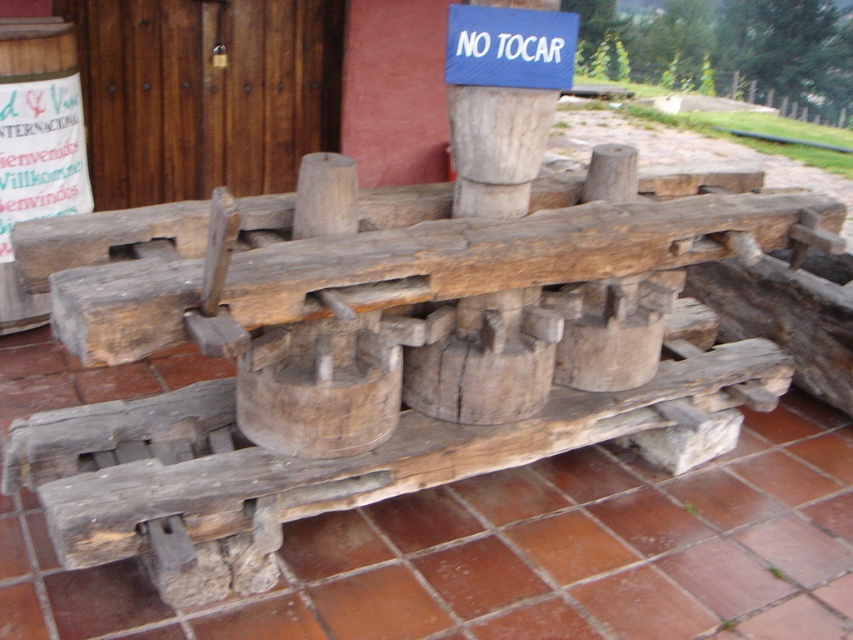
You are standing in front of the rustic wooden structure and notice a point marked at coordinates [496,147]. Which object in the scene does this point belong to?

The point at coordinates [496,147] is located on the wooden post at center.

You are a painter holding a 5 inch wide brush. You need to paint the wooden post at center and the blue fabric sign at upper center. Can you reach both objects with your brush without moving your position?

The distance between the wooden post at center and the blue fabric sign at upper center is 4.86 inches, which is less than the 5 inch width of your brush. Therefore, you can reach both objects with your brush without moving your position.